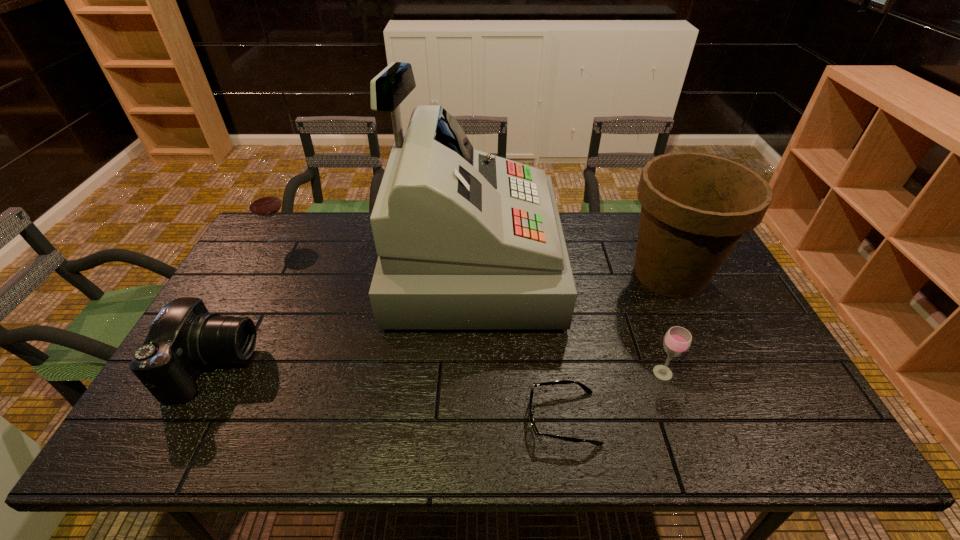
At what (x,y) coordinates should I click in order to perform the action: click on the tallest object. Please return your answer as a coordinate pair (x, y). The width and height of the screenshot is (960, 540). Looking at the image, I should click on (466, 240).

Identify the location of the second tallest object. (695, 207).

Locate an element on the screen. the farther wineglass is located at coordinates (264, 202).

Locate an element on the screen. the left wineglass is located at coordinates (264, 202).

I want to click on camera, so click(184, 337).

The width and height of the screenshot is (960, 540). I want to click on the right wineglass, so click(x=677, y=340).

Identify the location of the shorter wineglass. (677, 340).

Find the location of a particular element. the shortest object is located at coordinates (585, 388).

Locate an element on the screen. vacant space situated on the keypad side of the tallest object is located at coordinates (599, 264).

At what (x,y) coordinates should I click in order to perform the action: click on free location located 0.140m on the front of the flowerpot. Please return your answer as a coordinate pair (x, y). The height and width of the screenshot is (540, 960). Looking at the image, I should click on (706, 350).